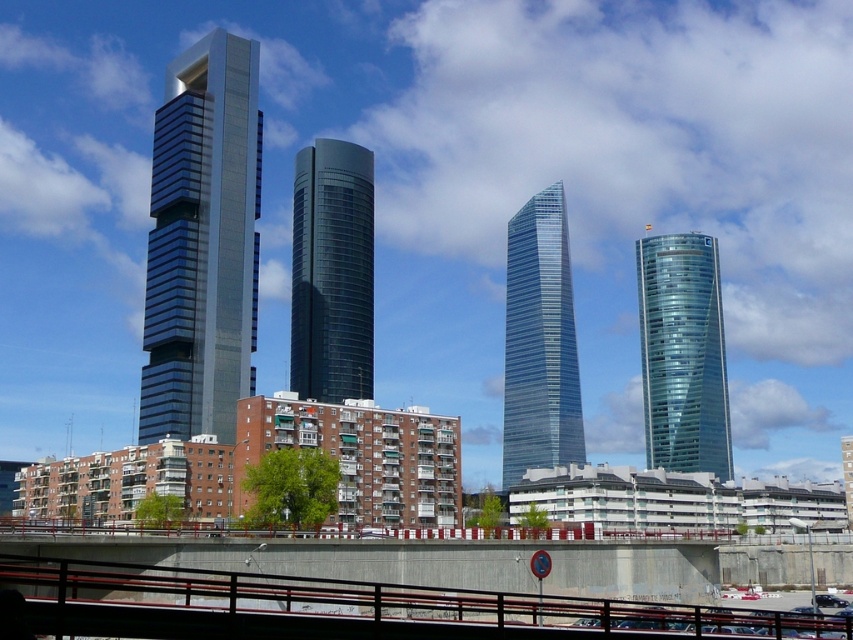
You are a city planner evaluating the urban layout. Given the shiny glass tower at center and the transparent glass tower at right, which one would cast a bigger shadow during midday? Please base your answer on their sizes as shown in the image.

The shiny glass tower at center is larger in size than the transparent glass tower at right, so it would cast a bigger shadow during midday.